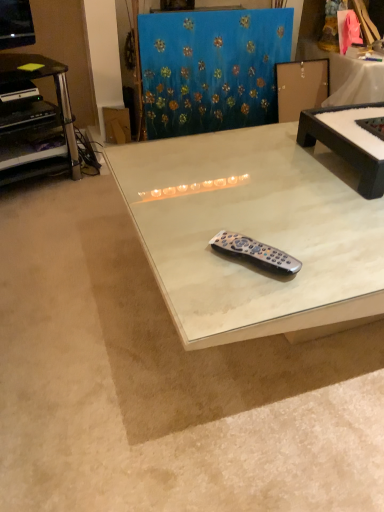
The height and width of the screenshot is (512, 384). In order to click on free spot in front of black plastic remote at center in this screenshot , I will do `click(244, 307)`.